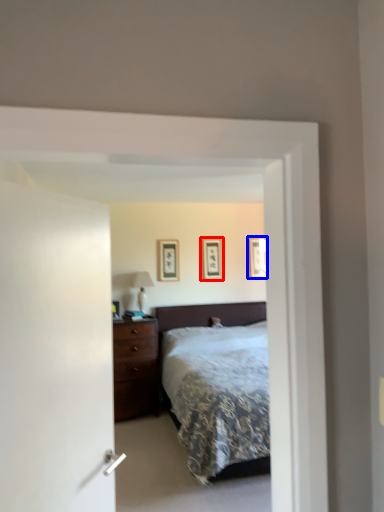
Question: Which of the following is the closest to the observer, picture frame (highlighted by a red box) or picture frame (highlighted by a blue box)?

Choices:
 (A) picture frame
 (B) picture frame

Answer: (A)